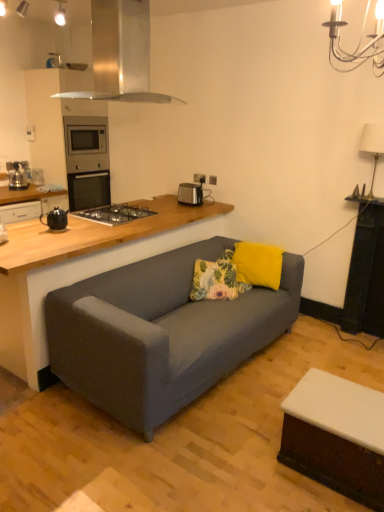
Question: Is matte black toaster at upper center touching black ceramic teapot at left, which is the second appliance from back to front?

Choices:
 (A) no
 (B) yes

Answer: (A)

Question: Considering the relative positions of matte black toaster at upper center and black ceramic teapot at left, which is the first appliance in left-to-right order, in the image provided, is matte black toaster at upper center to the right of black ceramic teapot at left, which is the first appliance in left-to-right order, from the viewer's perspective?

Choices:
 (A) no
 (B) yes

Answer: (B)

Question: From the image's perspective, would you say matte black toaster at upper center is shown under black ceramic teapot at left, which is counted as the 2th appliance, starting from the top?

Choices:
 (A) yes
 (B) no

Answer: (B)

Question: Does matte black toaster at upper center come behind black ceramic teapot at left, which is counted as the 2th appliance, starting from the top?

Choices:
 (A) yes
 (B) no

Answer: (A)

Question: Can you confirm if matte black toaster at upper center is smaller than black ceramic teapot at left, which is counted as the 2th appliance, starting from the top?

Choices:
 (A) no
 (B) yes

Answer: (B)

Question: Is matte black toaster at upper center far away from black ceramic teapot at left, which is the first appliance in front-to-back order?

Choices:
 (A) yes
 (B) no

Answer: (A)

Question: Is yellow fabric pillow at upper right, positioned as the first pillow in right-to-left order, oriented towards wooden countertop at lower left?

Choices:
 (A) no
 (B) yes

Answer: (A)

Question: From the image's perspective, is yellow fabric pillow at upper right, positioned as the first pillow in right-to-left order, located beneath wooden countertop at lower left?

Choices:
 (A) yes
 (B) no

Answer: (B)

Question: Can you confirm if yellow fabric pillow at upper right, positioned as the first pillow in right-to-left order, is positioned to the left of wooden countertop at lower left?

Choices:
 (A) no
 (B) yes

Answer: (A)

Question: Considering the relative positions of yellow fabric pillow at upper right, positioned as the first pillow in right-to-left order, and wooden countertop at lower left in the image provided, is yellow fabric pillow at upper right, positioned as the first pillow in right-to-left order, behind wooden countertop at lower left?

Choices:
 (A) yes
 (B) no

Answer: (A)

Question: Is wooden countertop at lower left inside yellow fabric pillow at upper right, positioned as the first pillow in right-to-left order?

Choices:
 (A) yes
 (B) no

Answer: (B)

Question: Is yellow fabric pillow at upper right, the 2th pillow from the left, at the right side of wooden countertop at lower left?

Choices:
 (A) yes
 (B) no

Answer: (A)

Question: Is floral fabric pillow at center, the 2th pillow from the right, facing towards matte black toaster at upper center?

Choices:
 (A) no
 (B) yes

Answer: (A)